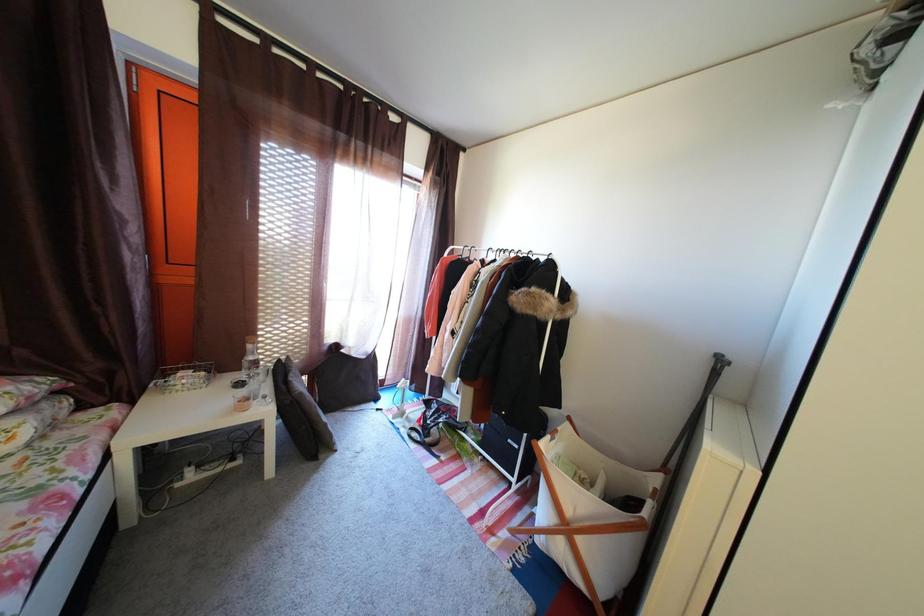
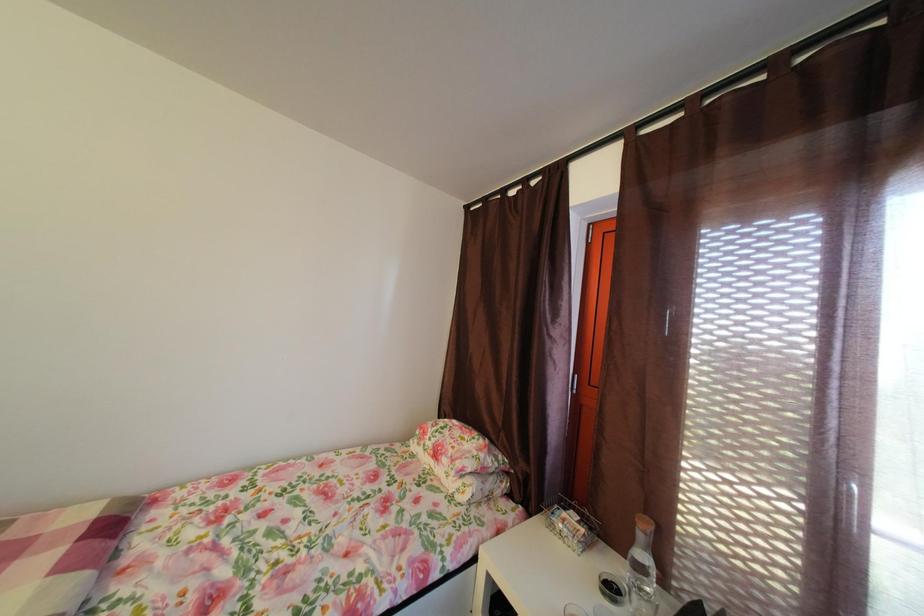
Question: The first image is from the beginning of the video and the second image is from the end. How did the camera likely rotate when shooting the video?

Choices:
 (A) Left
 (B) Right
 (C) Up
 (D) Down

Answer: (A)